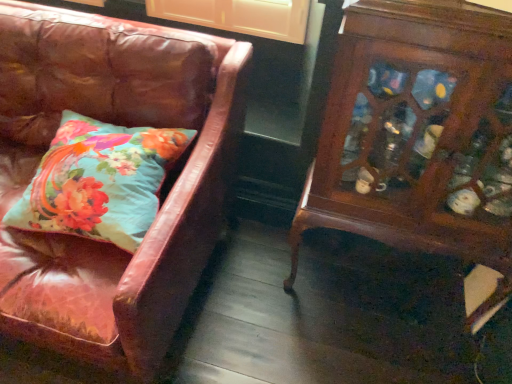
Find the location of `vacant space in front of wooden cabinet at right`. vacant space in front of wooden cabinet at right is located at coordinates (378, 352).